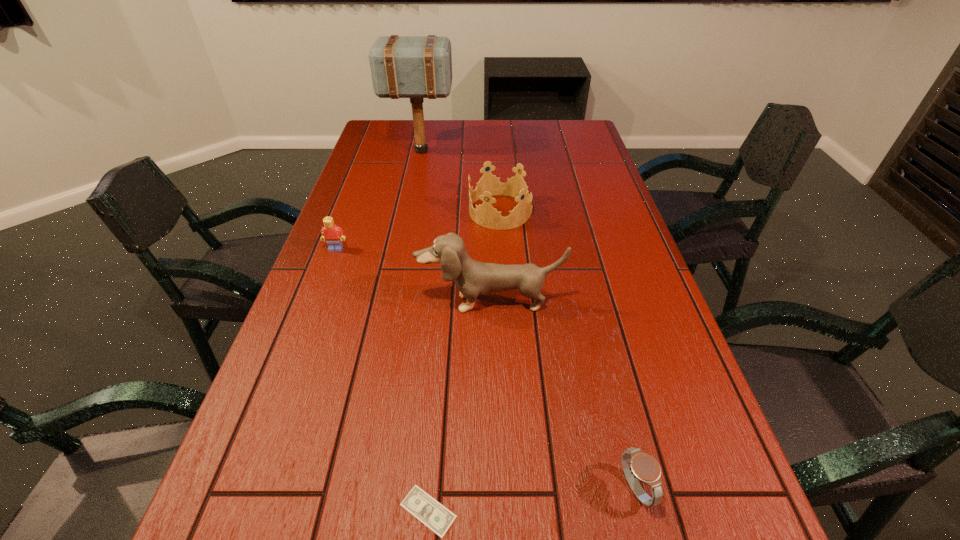
At what (x,y) coordinates should I click in order to perform the action: click on vacant area that lies between the tiara and the fifth shortest object. Please return your answer as a coordinate pair (x, y). Looking at the image, I should click on [495, 257].

Identify the location of free space between the watch and the second farthest object. (567, 350).

Locate an element on the screen. The width and height of the screenshot is (960, 540). unoccupied area between the second farthest object and the Lego is located at coordinates (419, 230).

Locate an element on the screen. This screenshot has height=540, width=960. free spot between the Lego and the tiara is located at coordinates (419, 230).

At what (x,y) coordinates should I click in order to perform the action: click on blank region between the third nearest object and the money. Please return your answer as a coordinate pair (x, y). Image resolution: width=960 pixels, height=540 pixels. Looking at the image, I should click on (459, 407).

The width and height of the screenshot is (960, 540). What are the coordinates of `vacant space in between the fifth tallest object and the fifth shortest object` in the screenshot? It's located at (562, 395).

This screenshot has width=960, height=540. I want to click on unoccupied position between the shortest object and the tiara, so click(465, 361).

The width and height of the screenshot is (960, 540). What are the coordinates of `free space that is in between the tiara and the third shortest object` in the screenshot? It's located at point(419,230).

Where is `object that is the closest one to the shortest object`? object that is the closest one to the shortest object is located at coordinates (637, 465).

Locate which object ranks second in proximity to the mallet. Please provide its 2D coordinates. Your answer should be formatted as a tuple, i.e. [(x, y)], where the tuple contains the x and y coordinates of a point satisfying the conditions above.

[(333, 235)]